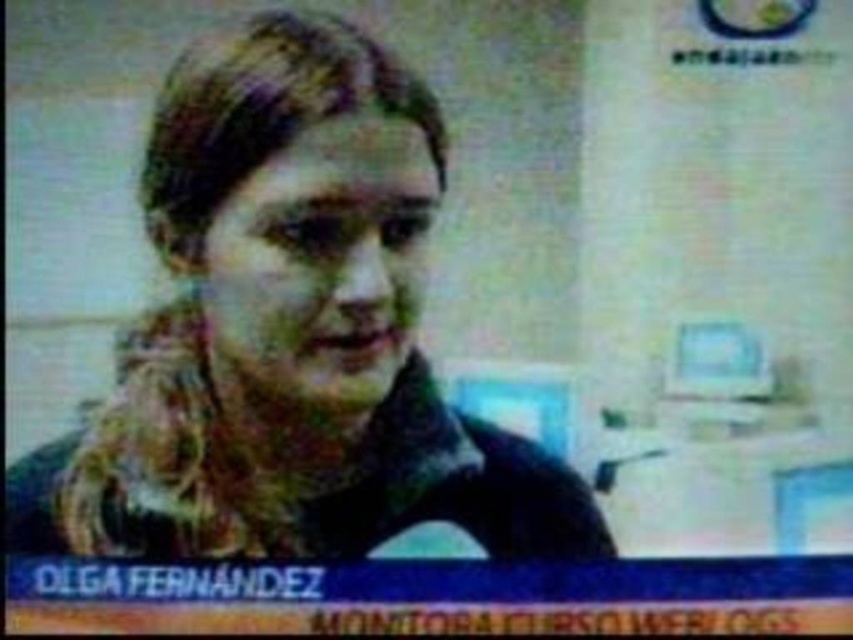
Based on the scene description, can you determine which object is positioned higher in the image between the dark brown hair at center and the smooth skin face at center?

The dark brown hair at center is taller than the smooth skin face at center, so the dark brown hair at center is positioned higher in the image.

You are a graphic designer working on a project that requires adjusting the size of two elements. You have the dark brown hair at center and the smooth skin face at center in your design. Which element should you resize to ensure both elements are the same size?

The dark brown hair at center is larger in size than the smooth skin face at center, so you should resize the dark brown hair at center to match the size of the smooth skin face at center.